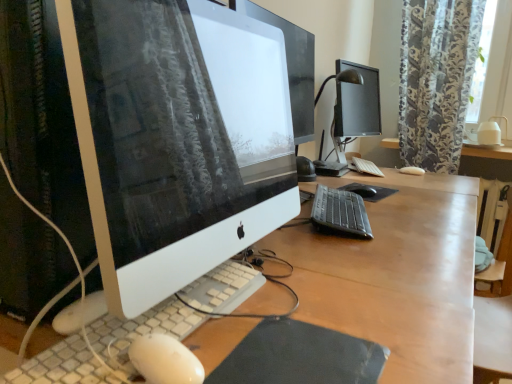
Question: Is floral-patterned fabric at upper right inside or outside of white glossy computer monitor at center?

Choices:
 (A) inside
 (B) outside

Answer: (B)

Question: Is point (408, 107) closer or farther from the camera than point (276, 162)?

Choices:
 (A) farther
 (B) closer

Answer: (A)

Question: Considering the real-world distances, which object is farthest from the white textured keyboard at center, acting as the first computer keyboard starting from the front?

Choices:
 (A) floral-patterned fabric at upper right
 (B) black rubber mousepad at center, the first mousepad from the top
 (C) white glossy computer monitor at center
 (D) black matte mousepad at lower center, marked as the second mousepad in a back-to-front arrangement
 (E) white matte keyboard at center, which appears as the first computer keyboard when viewed from the right

Answer: (A)

Question: Based on their relative distances, which object is nearer to the black matte mouse at center?

Choices:
 (A) floral-patterned fabric at upper right
 (B) black rubber mousepad at center, placed as the 1th mousepad when sorted from right to left
 (C) black plastic keyboard at center, acting as the second computer keyboard starting from the left
 (D) wooden desk at center, acting as the 2th desk starting from the front
 (E) white matte keyboard at center, marked as the first computer keyboard in a top-to-bottom arrangement

Answer: (B)